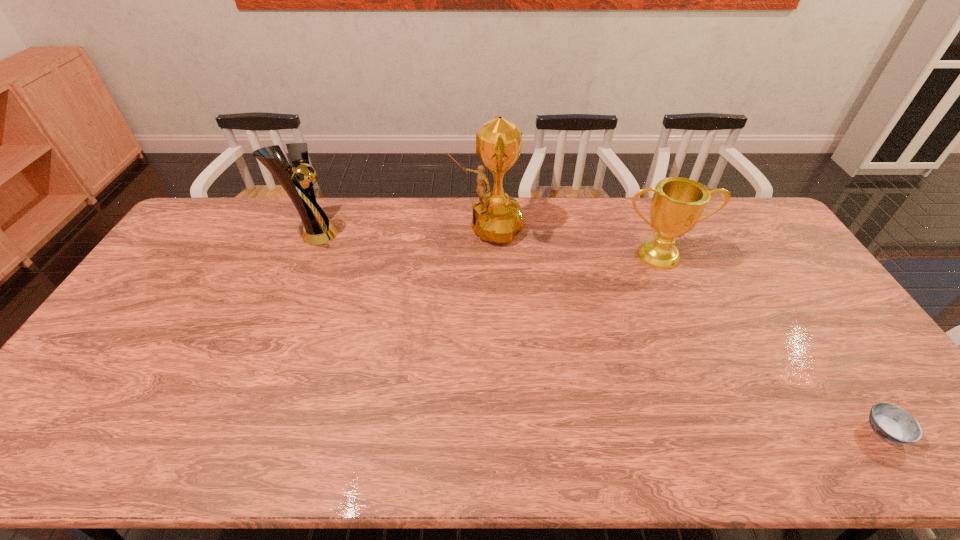
Image resolution: width=960 pixels, height=540 pixels. I want to click on free area in between the rightmost award and the nearest object, so click(x=773, y=343).

What are the coordinates of `empty location between the leftmost award and the third object from left to right` in the screenshot? It's located at (487, 245).

This screenshot has width=960, height=540. In order to click on free space between the shortest award and the leftmost award in this screenshot , I will do `click(487, 245)`.

This screenshot has height=540, width=960. What are the coordinates of `vacant area that lies between the rightmost object and the third object from right to left` in the screenshot? It's located at [x=685, y=328].

Where is `blank region between the leftmost object and the rightmost award`? blank region between the leftmost object and the rightmost award is located at coordinates (487, 245).

In order to click on free space between the leftmost object and the shortest object in this screenshot , I will do `click(599, 332)`.

The height and width of the screenshot is (540, 960). Find the location of `free space between the second award from right to left and the leftmost award`. free space between the second award from right to left and the leftmost award is located at coordinates (399, 230).

Identify the location of vacant space in between the third tallest object and the leftmost object. (487, 245).

Where is `empty space between the third object from left to right and the nearest object`? The width and height of the screenshot is (960, 540). empty space between the third object from left to right and the nearest object is located at coordinates (773, 343).

This screenshot has height=540, width=960. I want to click on vacant point located between the second award from left to right and the shortest object, so click(x=685, y=328).